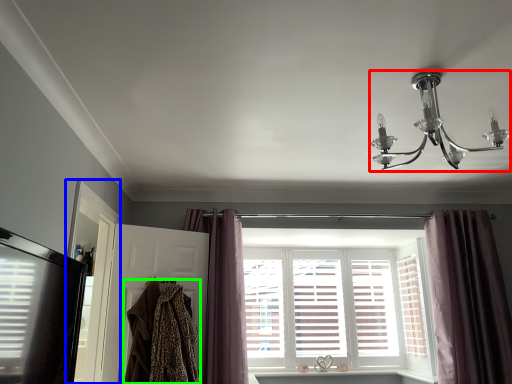
Question: Estimate the real-world distances between objects in this image. Which object is closer to lamp (highlighted by a red box), screen door (highlighted by a blue box) or clothing (highlighted by a green box)?

Choices:
 (A) screen door
 (B) clothing

Answer: (B)